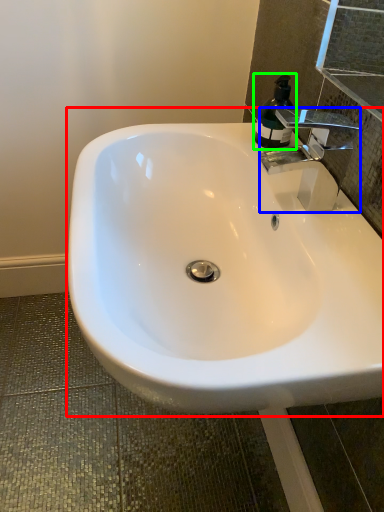
Question: Considering the real-world distances, which object is closest to sink (highlighted by a red box)? tap (highlighted by a blue box) or soap dispenser (highlighted by a green box).

Choices:
 (A) tap
 (B) soap dispenser

Answer: (A)